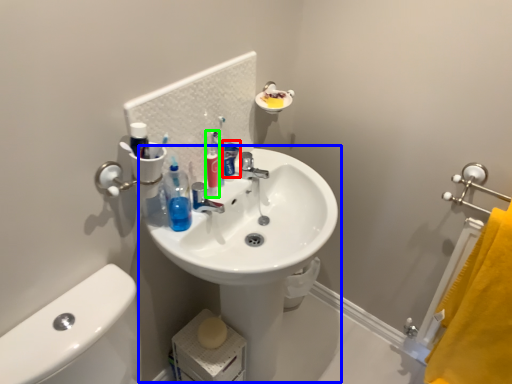
Question: Which object is the closest to the toothpaste (highlighted by a red box)? Choose among these: sink (highlighted by a blue box) or cleaning product (highlighted by a green box).

Choices:
 (A) sink
 (B) cleaning product

Answer: (B)